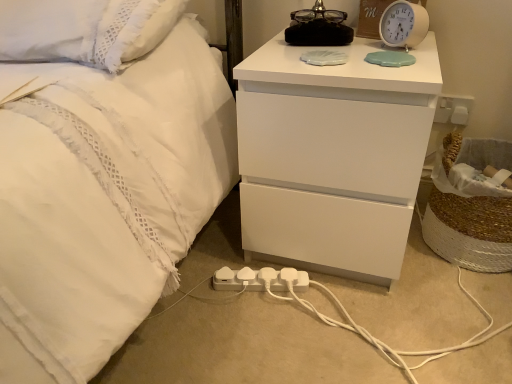
This screenshot has height=384, width=512. Find the location of `free space in front of white plastic extension cord at lower center`. free space in front of white plastic extension cord at lower center is located at coordinates (258, 339).